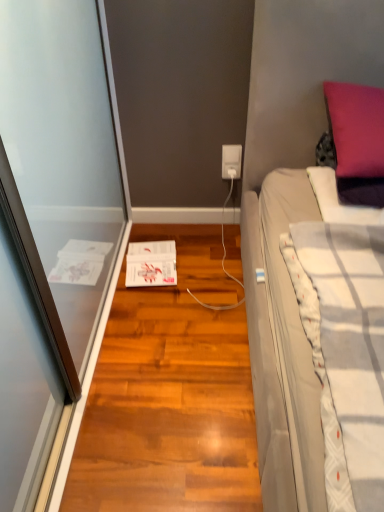
Where is `white plastic power outlet at center`? The height and width of the screenshot is (512, 384). white plastic power outlet at center is located at coordinates (231, 161).

This screenshot has height=512, width=384. In order to click on purple velvet pillow at upper right in this screenshot , I will do `click(356, 129)`.

This screenshot has width=384, height=512. I want to click on shiny brown hardwood floor at center, so click(170, 394).

Locate an element on the screen. white textured blanket at right is located at coordinates (339, 201).

Is white plastic power outlet at center located outside white textured blanket at right?

white plastic power outlet at center lies outside white textured blanket at right's area.

Where is `blanket that is in front of the white plastic power outlet at center`? This screenshot has width=384, height=512. blanket that is in front of the white plastic power outlet at center is located at coordinates (339, 201).

Between white plastic power outlet at center and white textured blanket at right, which one is positioned in front?

white textured blanket at right.

Measure the distance from shiny brown hardwood floor at center to purple velvet pillow at upper right.

A distance of 32.38 inches exists between shiny brown hardwood floor at center and purple velvet pillow at upper right.

Could you tell me if shiny brown hardwood floor at center is turned towards purple velvet pillow at upper right?

No, shiny brown hardwood floor at center is not turned towards purple velvet pillow at upper right.

Is point (174, 419) positioned behind point (367, 128)?

Yes, point (174, 419) is behind point (367, 128).

Can you confirm if shiny brown hardwood floor at center is bigger than purple velvet pillow at upper right?

Yes.

Considering the relative sizes of shiny brown hardwood floor at center and white textured blanket at right in the image provided, is shiny brown hardwood floor at center wider than white textured blanket at right?

Yes.

Locate an element on the screen. This screenshot has height=512, width=384. blanket behind the shiny brown hardwood floor at center is located at coordinates (339, 201).

Is the depth of white textured blanket at right greater than that of white plastic power outlet at center?

No, white textured blanket at right is in front of white plastic power outlet at center.

Find the location of a particular element. The image size is (384, 512). power outlet that is on the left side of white textured blanket at right is located at coordinates (231, 161).

Choose the correct answer: Is white textured blanket at right inside white plastic power outlet at center or outside it?

white textured blanket at right is not enclosed by white plastic power outlet at center.

Is white plastic power outlet at center further to camera compared to purple velvet pillow at upper right?

Yes, it is.

Considering the sizes of objects white plastic power outlet at center and purple velvet pillow at upper right in the image provided, who is bigger, white plastic power outlet at center or purple velvet pillow at upper right?

purple velvet pillow at upper right.

Is white plastic power outlet at center shorter than purple velvet pillow at upper right?

Yes, white plastic power outlet at center is shorter than purple velvet pillow at upper right.

Does white textured blanket at right turn towards shiny brown hardwood floor at center?

No, white textured blanket at right is not facing towards shiny brown hardwood floor at center.

Looking at this image, is white textured blanket at right positioned behind shiny brown hardwood floor at center?

Yes, white textured blanket at right is further from the viewer.

Between white textured blanket at right and shiny brown hardwood floor at center, which one has larger size?

With larger size is shiny brown hardwood floor at center.

Is white textured blanket at right far away from shiny brown hardwood floor at center?

white textured blanket at right is actually quite close to shiny brown hardwood floor at center.

How much distance is there between white plastic power outlet at center and shiny brown hardwood floor at center?

They are 33.15 inches apart.

From the image's perspective, which is above, white plastic power outlet at center or shiny brown hardwood floor at center?

white plastic power outlet at center appears higher in the image.

Between white plastic power outlet at center and shiny brown hardwood floor at center, which one has smaller width?

With smaller width is white plastic power outlet at center.

Could you tell me if white plastic power outlet at center is turned towards shiny brown hardwood floor at center?

Yes.

Where is `blanket that is on the right side of white plastic power outlet at center`? blanket that is on the right side of white plastic power outlet at center is located at coordinates (339, 201).

The image size is (384, 512). In order to click on hardwood in front of the purple velvet pillow at upper right in this screenshot , I will do `click(170, 394)`.

Based on their spatial positions, is white textured blanket at right or shiny brown hardwood floor at center closer to purple velvet pillow at upper right?

Among the two, white textured blanket at right is located nearer to purple velvet pillow at upper right.

Based on their spatial positions, is white plastic power outlet at center or white textured blanket at right further from shiny brown hardwood floor at center?

Based on the image, white plastic power outlet at center appears to be further to shiny brown hardwood floor at center.

When comparing their distances from white plastic power outlet at center, does white textured blanket at right or shiny brown hardwood floor at center seem closer?

Among the two, white textured blanket at right is located nearer to white plastic power outlet at center.

Which object lies nearer to the anchor point white plastic power outlet at center, purple velvet pillow at upper right or white textured blanket at right?

The object closer to white plastic power outlet at center is white textured blanket at right.

Considering their positions, is shiny brown hardwood floor at center positioned closer to purple velvet pillow at upper right than white textured blanket at right?

white textured blanket at right is closer to purple velvet pillow at upper right.

Looking at the image, which one is located closer to purple velvet pillow at upper right, white textured blanket at right or white plastic power outlet at center?

white textured blanket at right lies closer to purple velvet pillow at upper right than the other object.

When comparing their distances from shiny brown hardwood floor at center, does white plastic power outlet at center or purple velvet pillow at upper right seem further?

white plastic power outlet at center.

From the image, which object appears to be farther from white textured blanket at right, white plastic power outlet at center or shiny brown hardwood floor at center?

shiny brown hardwood floor at center is positioned further to the anchor white textured blanket at right.

You are a GUI agent. You are given a task and a screenshot of the screen. Output one action in this format:
    pyautogui.click(x=<x>, y=<y>)
    Task: Click on the blanket that lies between purple velvet pillow at upper right and shiny brown hardwood floor at center from top to bottom
    The image size is (384, 512).
    Given the screenshot: What is the action you would take?
    pyautogui.click(x=339, y=201)

Locate an element on the screen. This screenshot has height=512, width=384. blanket between purple velvet pillow at upper right and white plastic power outlet at center along the z-axis is located at coordinates (339, 201).

The image size is (384, 512). I want to click on pillow between shiny brown hardwood floor at center and white plastic power outlet at center from front to back, so click(x=356, y=129).

The height and width of the screenshot is (512, 384). I want to click on blanket located between shiny brown hardwood floor at center and white plastic power outlet at center in the depth direction, so click(x=339, y=201).